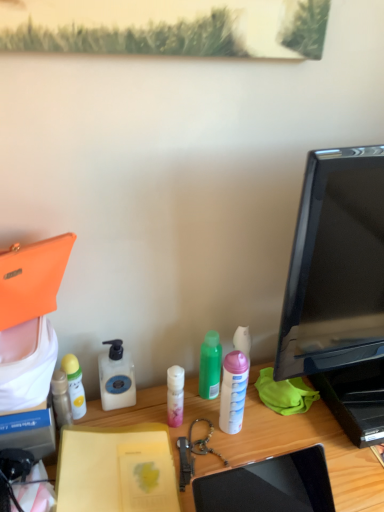
Where is `free space above yellow matte notebook at center (from a real-world perspective)`? The height and width of the screenshot is (512, 384). free space above yellow matte notebook at center (from a real-world perspective) is located at coordinates (110, 475).